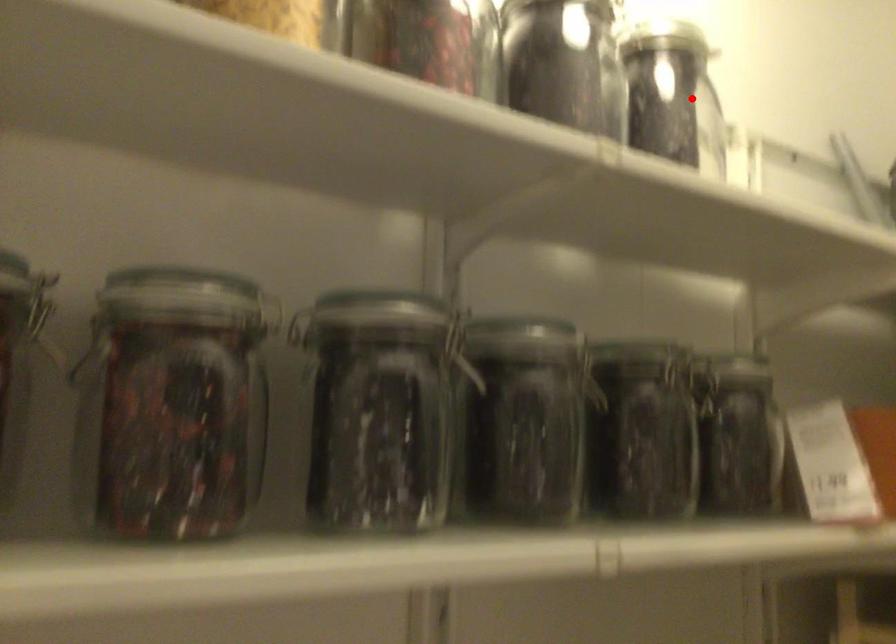
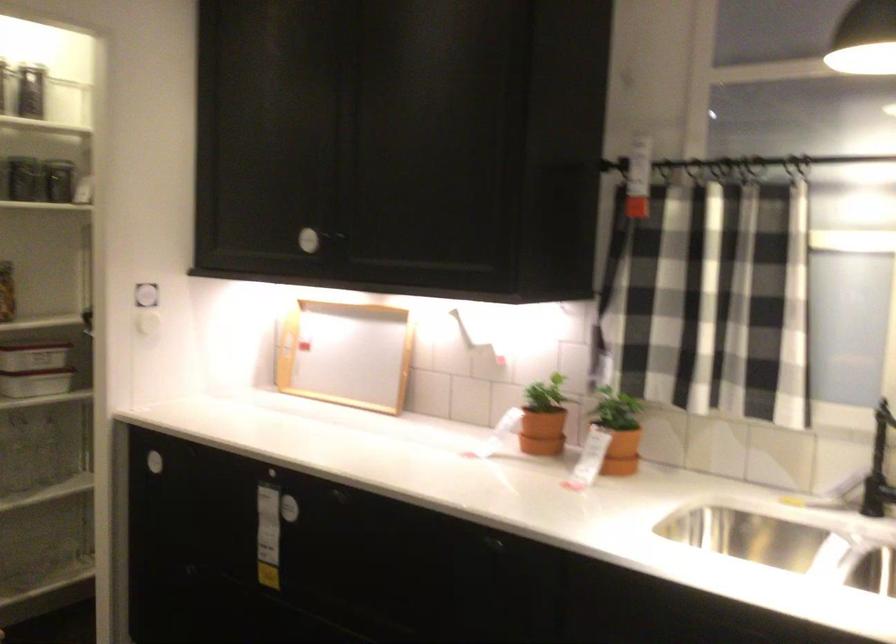
Question: I am providing you with two images of the same scene from different viewpoints. In image1, a red point is highlighted. Considering the same 3D point in image2, which of the following is correct?

Choices:
 (A) It is closer
 (B) It is farther

Answer: (B)